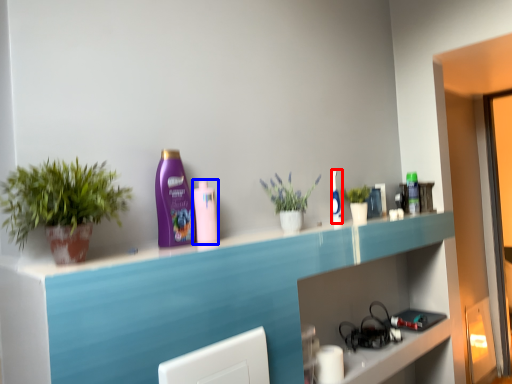
Question: Among these objects, which one is farthest to the camera, mouthwash (highlighted by a red box) or mouthwash (highlighted by a blue box)?

Choices:
 (A) mouthwash
 (B) mouthwash

Answer: (A)